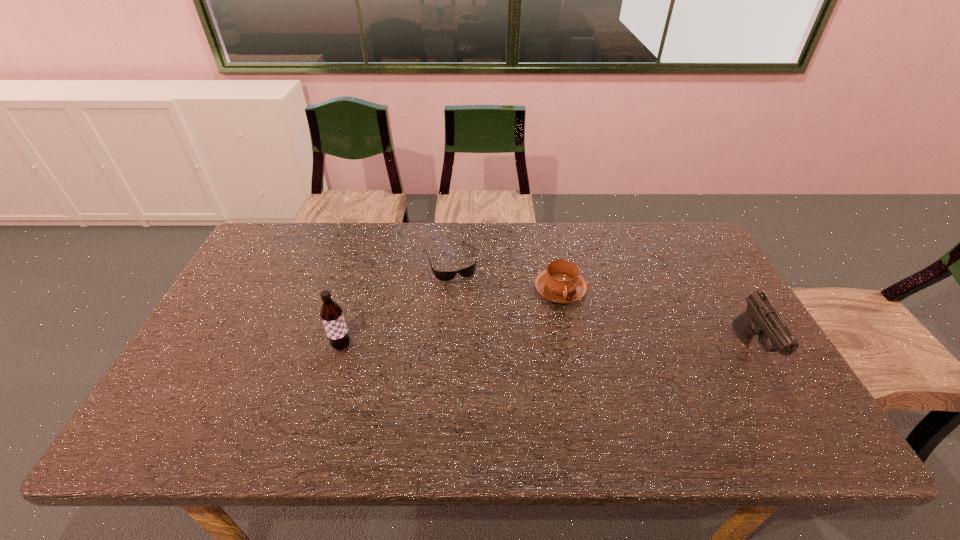
The height and width of the screenshot is (540, 960). I want to click on free space at the far edge of the desktop, so click(419, 223).

At what (x,y) coordinates should I click in order to perform the action: click on free space at the near edge. Please return your answer as a coordinate pair (x, y). Image resolution: width=960 pixels, height=540 pixels. Looking at the image, I should click on (367, 402).

At what (x,y) coordinates should I click in order to perform the action: click on vacant space at the left edge of the desktop. Please return your answer as a coordinate pair (x, y). This screenshot has height=540, width=960. Looking at the image, I should click on (287, 284).

Identify the location of vacant space at the right edge. This screenshot has width=960, height=540. (692, 275).

Image resolution: width=960 pixels, height=540 pixels. In the image, there is a desktop. What are the coordinates of `vacant space at the far left corner` in the screenshot? It's located at (283, 259).

Where is `vacant area at the far right corner`? vacant area at the far right corner is located at coordinates (680, 246).

Image resolution: width=960 pixels, height=540 pixels. What are the coordinates of `free space between the rightmost object and the root beer` in the screenshot? It's located at (546, 348).

Locate an element on the screen. free point between the shortest object and the cappuccino is located at coordinates [505, 275].

You are a GUI agent. You are given a task and a screenshot of the screen. Output one action in this format:
    pyautogui.click(x=<x>, y=<y>)
    Task: Click on the free space that is in between the shortest object and the third shortest object
    Image resolution: width=960 pixels, height=540 pixels.
    Given the screenshot: What is the action you would take?
    pyautogui.click(x=600, y=305)

Identify the location of empty location between the third shortest object and the cappuccino. The width and height of the screenshot is (960, 540). (656, 320).